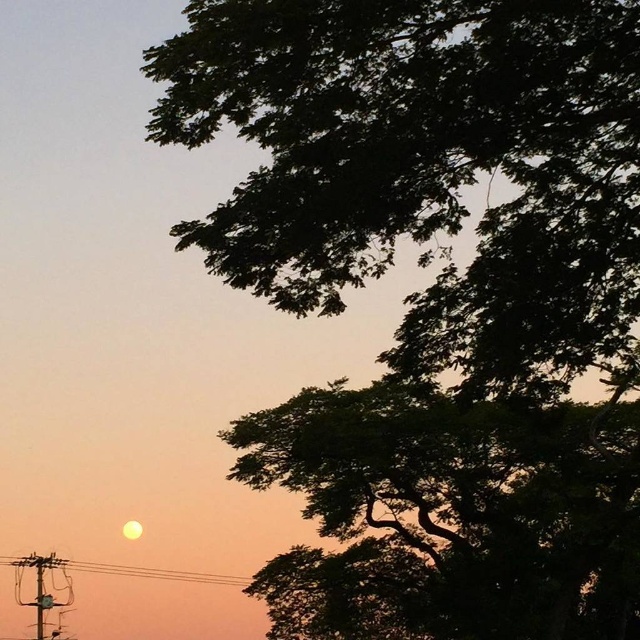
Question: Does dark green leafy tree at upper right have a smaller size compared to metallic wire at lower left?

Choices:
 (A) yes
 (B) no

Answer: (B)

Question: Can you confirm if dark green leafy tree at upper right is positioned to the left of metallic wire at lower left?

Choices:
 (A) no
 (B) yes

Answer: (A)

Question: Can you confirm if dark green leafy tree at upper right is wider than metallic wire at lower left?

Choices:
 (A) no
 (B) yes

Answer: (B)

Question: Which point is farther to the camera?

Choices:
 (A) (140, 572)
 (B) (275, 624)

Answer: (A)